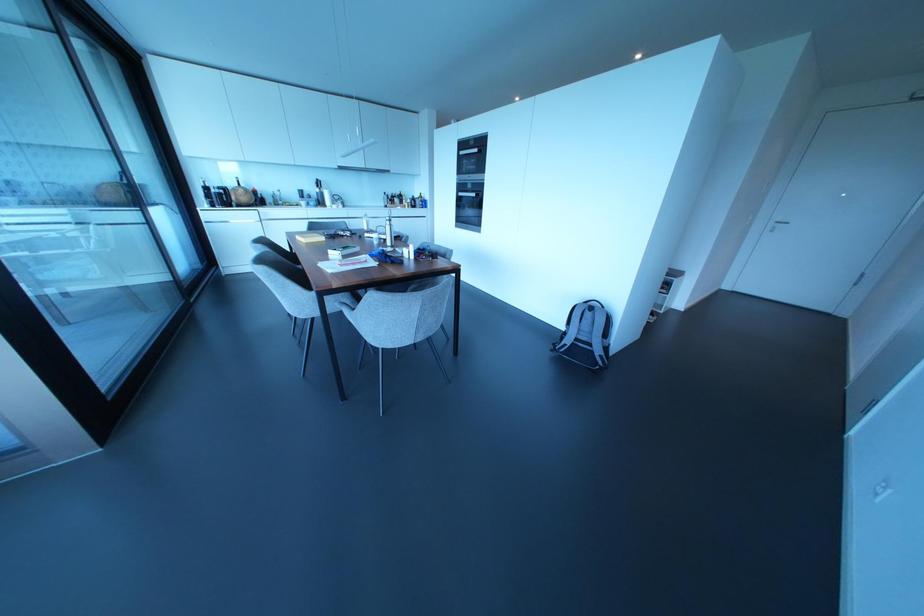
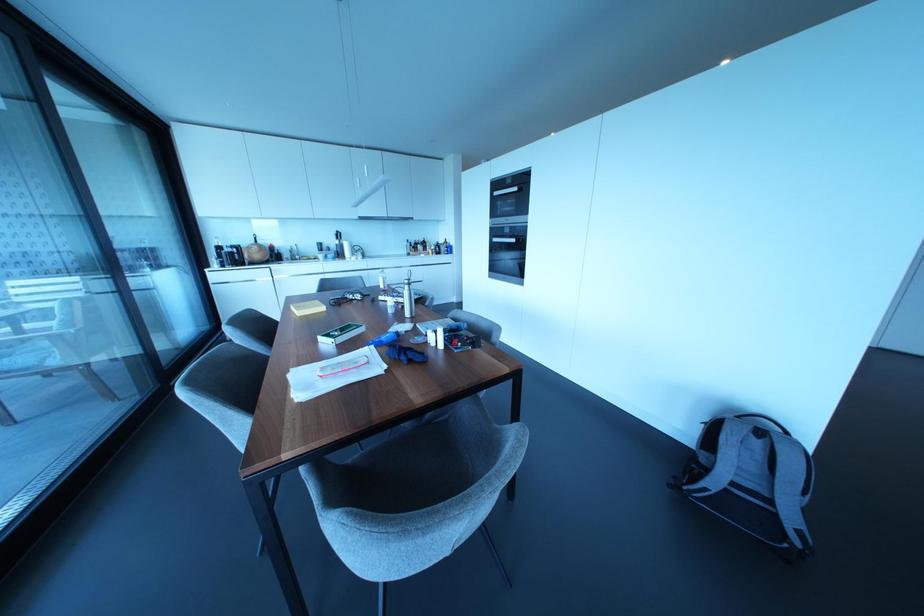
Where in the second image is the point corresponding to point (322, 238) from the first image?

(322, 308)